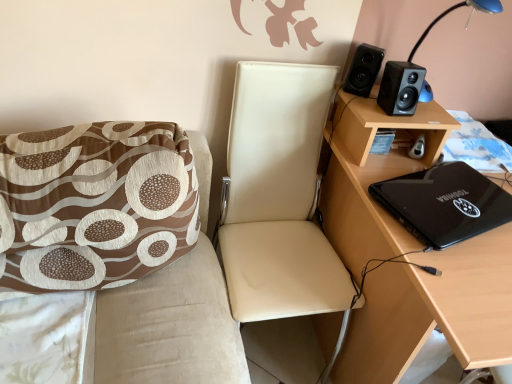
Locate an element on the screen. The height and width of the screenshot is (384, 512). leather-like beige chair at center, the 2th chair positioned from the left is located at coordinates (279, 198).

The height and width of the screenshot is (384, 512). Describe the element at coordinates (444, 203) in the screenshot. I see `black glossy laptop at right` at that location.

The image size is (512, 384). What do you see at coordinates (456, 8) in the screenshot?
I see `black plastic table lamp at upper right` at bounding box center [456, 8].

Locate an element on the screen. brown printed fabric cushion at left, the 2th chair from the right is located at coordinates tap(173, 315).

Could you tell me if black glossy laptop at right is facing black plastic table lamp at upper right?

No, black glossy laptop at right does not turn towards black plastic table lamp at upper right.

What's the angular difference between black glossy laptop at right and black plastic table lamp at upper right's facing directions?

14.7 degrees.

Looking at this image, looking at the image, does black glossy laptop at right seem bigger or smaller compared to black plastic table lamp at upper right?

black glossy laptop at right is smaller than black plastic table lamp at upper right.

From the image's perspective, which one is positioned higher, black matte desk at right or blue floral fabric at lower right?

blue floral fabric at lower right, from the image's perspective.

Is black matte desk at right not near blue floral fabric at lower right?

No, black matte desk at right is not far away from blue floral fabric at lower right.

Is black matte desk at right turned away from blue floral fabric at lower right?

Absolutely, black matte desk at right is directed away from blue floral fabric at lower right.

Is black matte desk at right not within blue floral fabric at lower right?

Yes, black matte desk at right is outside of blue floral fabric at lower right.

Does black matte speaker at upper right, the second speaker positioned from the right, have a lesser width compared to black matte speaker at upper right, the 2th speaker viewed from the left?

No, black matte speaker at upper right, the second speaker positioned from the right, is not thinner than black matte speaker at upper right, the 2th speaker viewed from the left.

Does black matte speaker at upper right, the 1th speaker in the left-to-right sequence, touch black matte speaker at upper right, arranged as the 1th speaker when viewed from the right?

Yes.

How different are the orientations of black matte speaker at upper right, the 1th speaker in the left-to-right sequence, and black matte speaker at upper right, the 2th speaker viewed from the left, in degrees?

black matte speaker at upper right, the 1th speaker in the left-to-right sequence, and black matte speaker at upper right, the 2th speaker viewed from the left, are facing 38 degrees away from each other.

Would you say black matte speaker at upper right, the 1th speaker in the left-to-right sequence, is inside or outside black matte speaker at upper right, arranged as the 1th speaker when viewed from the right?

black matte speaker at upper right, the 1th speaker in the left-to-right sequence, is outside black matte speaker at upper right, arranged as the 1th speaker when viewed from the right.

Where is `the 2nd speaker behind when counting from the black matte desk at right`? the 2nd speaker behind when counting from the black matte desk at right is located at coordinates (362, 70).

Looking at this image, is black matte speaker at upper right, the 1th speaker in the left-to-right sequence, to the left or to the right of black matte desk at right in the image?

Clearly, black matte speaker at upper right, the 1th speaker in the left-to-right sequence, is on the left of black matte desk at right in the image.

In the scene shown: Can you confirm if black matte speaker at upper right, the 1th speaker in the left-to-right sequence, is wider than black matte desk at right?

No, black matte speaker at upper right, the 1th speaker in the left-to-right sequence, is not wider than black matte desk at right.

From the image's perspective, which object appears higher, black matte speaker at upper right, the 1th speaker in the left-to-right sequence, or black matte desk at right?

black matte speaker at upper right, the 1th speaker in the left-to-right sequence, from the image's perspective.

Which object is wider, black matte desk at right or leather-like beige chair at center, the 1th chair from the right?

black matte desk at right is wider.

Can you confirm if black matte desk at right is smaller than leather-like beige chair at center, the 1th chair from the right?

No, black matte desk at right is not smaller than leather-like beige chair at center, the 1th chair from the right.

Are black matte desk at right and leather-like beige chair at center, the 1th chair from the right, beside each other?

No.

Is leather-like beige chair at center, the 2th chair positioned from the left, inside black matte desk at right?

No, leather-like beige chair at center, the 2th chair positioned from the left, is not a part of black matte desk at right.

From a real-world perspective, is leather-like beige chair at center, the 2th chair positioned from the left, physically below black matte speaker at upper right, the 1th speaker in the left-to-right sequence?

Indeed, from a real-world perspective, leather-like beige chair at center, the 2th chair positioned from the left, is positioned beneath black matte speaker at upper right, the 1th speaker in the left-to-right sequence.

Which object is closer to the camera, leather-like beige chair at center, the 2th chair positioned from the left, or black matte speaker at upper right, the 1th speaker in the left-to-right sequence?

leather-like beige chair at center, the 2th chair positioned from the left, is closer to the camera.

Is leather-like beige chair at center, the 2th chair positioned from the left, looking in the opposite direction of black matte speaker at upper right, the 1th speaker in the left-to-right sequence?

No, black matte speaker at upper right, the 1th speaker in the left-to-right sequence, is not at the back of leather-like beige chair at center, the 2th chair positioned from the left.

Is leather-like beige chair at center, the 1th chair from the right, thinner than black matte speaker at upper right, the 1th speaker in the left-to-right sequence?

Incorrect, the width of leather-like beige chair at center, the 1th chair from the right, is not less than that of black matte speaker at upper right, the 1th speaker in the left-to-right sequence.

Consider the image. Considering the sizes of objects black matte desk at right and black matte speaker at upper right, arranged as the 1th speaker when viewed from the right, in the image provided, who is smaller, black matte desk at right or black matte speaker at upper right, arranged as the 1th speaker when viewed from the right,?

Smaller between the two is black matte speaker at upper right, arranged as the 1th speaker when viewed from the right.

Looking at their sizes, would you say black matte desk at right is wider or thinner than black matte speaker at upper right, arranged as the 1th speaker when viewed from the right?

In the image, black matte desk at right appears to be wider than black matte speaker at upper right, arranged as the 1th speaker when viewed from the right.

Does black matte desk at right have a greater height compared to black matte speaker at upper right, arranged as the 1th speaker when viewed from the right?

Yes, black matte desk at right is taller than black matte speaker at upper right, arranged as the 1th speaker when viewed from the right.

The image size is (512, 384). What are the coordinates of `laptop located on the right of black plastic table lamp at upper right` in the screenshot? It's located at (444, 203).

Where is `quilt that is on the left side of black matte desk at right`? Image resolution: width=512 pixels, height=384 pixels. quilt that is on the left side of black matte desk at right is located at coordinates (476, 146).

Based on the photo, estimate the real-world distances between objects in this image. Which object is closer to leather-like beige chair at center, the 1th chair from the right, black matte speaker at upper right, the second speaker positioned from the right, or brown printed fabric cushion at left, acting as the first chair starting from the left?

brown printed fabric cushion at left, acting as the first chair starting from the left, is positioned closer to the anchor leather-like beige chair at center, the 1th chair from the right.

When comparing their distances from brown printed fabric cushion at left, the 2th chair from the right, does black glossy laptop at right or blue floral fabric at lower right seem closer?

The object closer to brown printed fabric cushion at left, the 2th chair from the right, is black glossy laptop at right.

From the image, which object appears to be farther from black matte speaker at upper right, the second speaker positioned from the right, black matte speaker at upper right, the 2th speaker viewed from the left, or black glossy laptop at right?

Based on the image, black glossy laptop at right appears to be further to black matte speaker at upper right, the second speaker positioned from the right.

From the image, which object appears to be farther from black matte speaker at upper right, arranged as the 1th speaker when viewed from the right, leather-like beige chair at center, the 2th chair positioned from the left, or blue floral fabric at lower right?

leather-like beige chair at center, the 2th chair positioned from the left, is further to black matte speaker at upper right, arranged as the 1th speaker when viewed from the right.

Estimate the real-world distances between objects in this image. Which object is closer to black glossy laptop at right, black matte desk at right or brown printed fabric cushion at left, acting as the first chair starting from the left?

black matte desk at right lies closer to black glossy laptop at right than the other object.

Considering their positions, is black plastic table lamp at upper right positioned closer to brown printed fabric cushion at left, the 2th chair from the right, than black matte speaker at upper right, arranged as the 1th speaker when viewed from the right?

black matte speaker at upper right, arranged as the 1th speaker when viewed from the right, lies closer to brown printed fabric cushion at left, the 2th chair from the right, than the other object.

Estimate the real-world distances between objects in this image. Which object is closer to black matte speaker at upper right, arranged as the 1th speaker when viewed from the right, leather-like beige chair at center, the 1th chair from the right, or black matte speaker at upper right, the second speaker positioned from the right?

black matte speaker at upper right, the second speaker positioned from the right, lies closer to black matte speaker at upper right, arranged as the 1th speaker when viewed from the right, than the other object.

Based on their spatial positions, is blue floral fabric at lower right or black matte speaker at upper right, arranged as the 1th speaker when viewed from the right, closer to black matte speaker at upper right, the second speaker positioned from the right?

Based on the image, black matte speaker at upper right, arranged as the 1th speaker when viewed from the right, appears to be nearer to black matte speaker at upper right, the second speaker positioned from the right.

At what (x,y) coordinates should I click in order to perform the action: click on table lamp between leather-like beige chair at center, the 2th chair positioned from the left, and blue floral fabric at lower right from left to right. Please return your answer as a coordinate pair (x, y). Looking at the image, I should click on click(456, 8).

Where is `speaker between black matte speaker at upper right, the second speaker positioned from the right, and black matte desk at right, in the vertical direction`? speaker between black matte speaker at upper right, the second speaker positioned from the right, and black matte desk at right, in the vertical direction is located at coordinates [x=400, y=88].

You are a GUI agent. You are given a task and a screenshot of the screen. Output one action in this format:
    pyautogui.click(x=<x>, y=<y>)
    Task: Click on the laptop between black matte speaker at upper right, arranged as the 1th speaker when viewed from the right, and black matte desk at right, in the vertical direction
    The width and height of the screenshot is (512, 384).
    Given the screenshot: What is the action you would take?
    pyautogui.click(x=444, y=203)

You are a GUI agent. You are given a task and a screenshot of the screen. Output one action in this format:
    pyautogui.click(x=<x>, y=<y>)
    Task: Click on the table lamp situated between brown printed fabric cushion at left, the 2th chair from the right, and black matte desk at right from left to right
    The width and height of the screenshot is (512, 384).
    Given the screenshot: What is the action you would take?
    pyautogui.click(x=456, y=8)